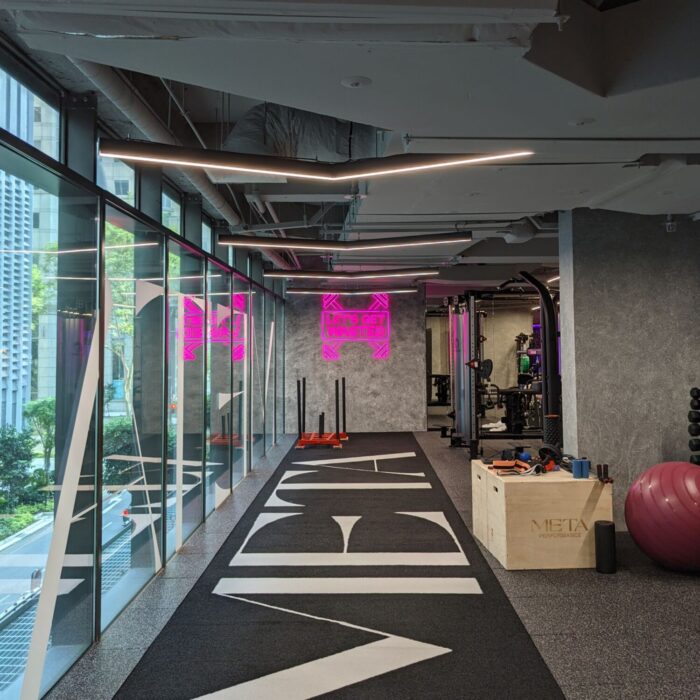
This screenshot has width=700, height=700. I want to click on black carpet with bold white text, so click(x=358, y=544).